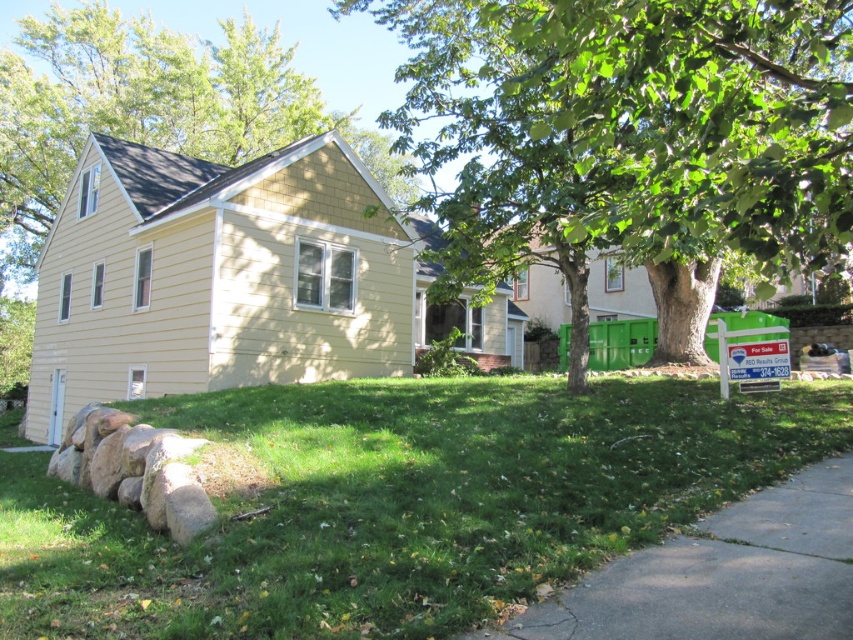
You are a landscape architect designing a garden path. You need to decide whether to place a large decorative rock near the green leafy tree at center or the gray concrete pavement at lower right. Based on their sizes, which area can accommodate a larger rock?

The green leafy tree at center is larger in size than the gray concrete pavement at lower right, so it can accommodate a larger decorative rock.

You are standing on the green grass at lower center and want to walk to the front door of the house. Which direction should you go relative to the green leafy tree at center?

The green grass at lower center is positioned on the left side of green leafy tree at center, so to reach the front door of the house, you should walk to the right of the green leafy tree at center.